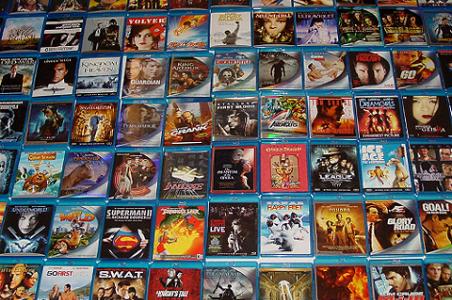
This screenshot has height=300, width=452. Find the location of `dvds in 2nd row from bottom`. dvds in 2nd row from bottom is located at coordinates (440, 228), (375, 231), (322, 225), (273, 226), (225, 228), (174, 227), (129, 232), (77, 228), (26, 231).